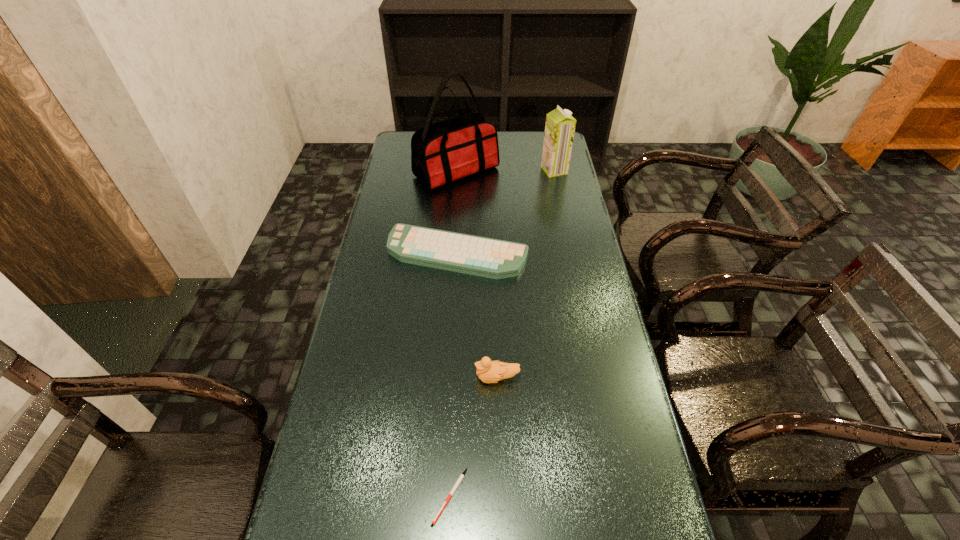
The image size is (960, 540). What are the coordinates of `vacant space at the far edge` in the screenshot? It's located at (508, 137).

Find the location of a particular element. vacant space at the left edge of the desktop is located at coordinates (406, 211).

Locate an element on the screen. free space at the right edge of the desktop is located at coordinates (588, 481).

Where is `free space at the far right corner of the desktop`? This screenshot has height=540, width=960. free space at the far right corner of the desktop is located at coordinates (534, 156).

Locate an element on the screen. This screenshot has width=960, height=540. vacant area that lies between the duffel bag and the third farthest object is located at coordinates [457, 212].

I want to click on free point between the soya milk and the second nearest object, so click(525, 274).

Where is `vacant area that lies between the third tallest object and the soya milk`? vacant area that lies between the third tallest object and the soya milk is located at coordinates (525, 274).

Where is `vacant space that's between the fourth shortest object and the duffel bag`? The width and height of the screenshot is (960, 540). vacant space that's between the fourth shortest object and the duffel bag is located at coordinates tap(505, 171).

The width and height of the screenshot is (960, 540). What are the coordinates of `free spot between the rightmost object and the fourth tallest object` in the screenshot? It's located at (506, 212).

Where is `empty space that is in between the third shortest object and the shortest object`? The image size is (960, 540). empty space that is in between the third shortest object and the shortest object is located at coordinates (473, 437).